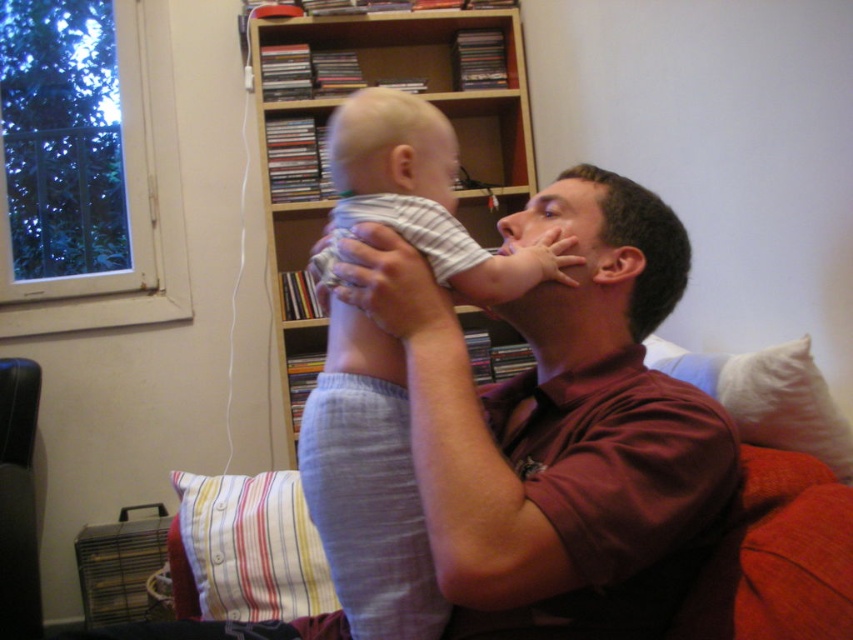
Identify the location of striped cotton shirt at center. (424, 195).

In the scene shown: Does striped cotton shirt at center appear on the left side of white soft pillow at right?

Yes, striped cotton shirt at center is to the left of white soft pillow at right.

Who is more distant from viewer, (341, 220) or (785, 368)?

Positioned behind is point (785, 368).

Where is `striped cotton shirt at center`? The width and height of the screenshot is (853, 640). striped cotton shirt at center is located at coordinates (424, 195).

Who is taller, gray striped shirt at center or striped cotton shirt at center?

With more height is gray striped shirt at center.

What do you see at coordinates (368, 484) in the screenshot?
I see `gray striped shirt at center` at bounding box center [368, 484].

Who is more forward, (334, 492) or (352, 138)?

Positioned in front is point (334, 492).

This screenshot has width=853, height=640. I want to click on gray striped shirt at center, so click(368, 484).

Which is behind, point (418, 220) or point (309, 348)?

The point (309, 348) is more distant.

Who is more distant from viewer, (442,621) or (263,115)?

The point (263,115) is behind.

Locate an element on the screen. This screenshot has height=640, width=853. gray striped shirt at center is located at coordinates (368, 484).